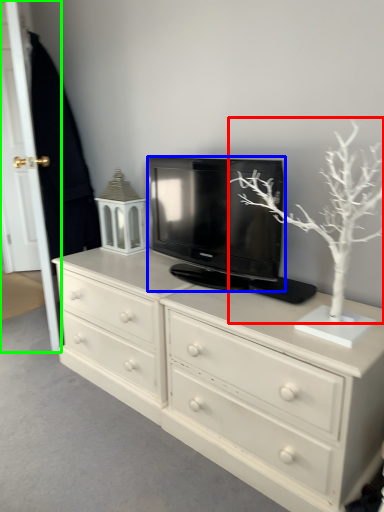
Question: Which object is the farthest from tree (highlighted by a red box)? Choose among these: television (highlighted by a blue box) or door (highlighted by a green box).

Choices:
 (A) television
 (B) door

Answer: (B)